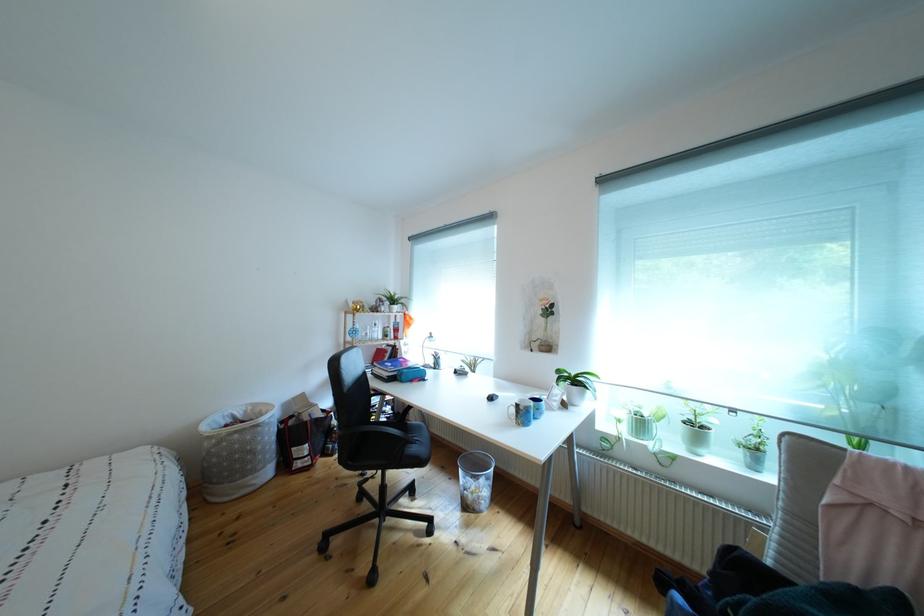
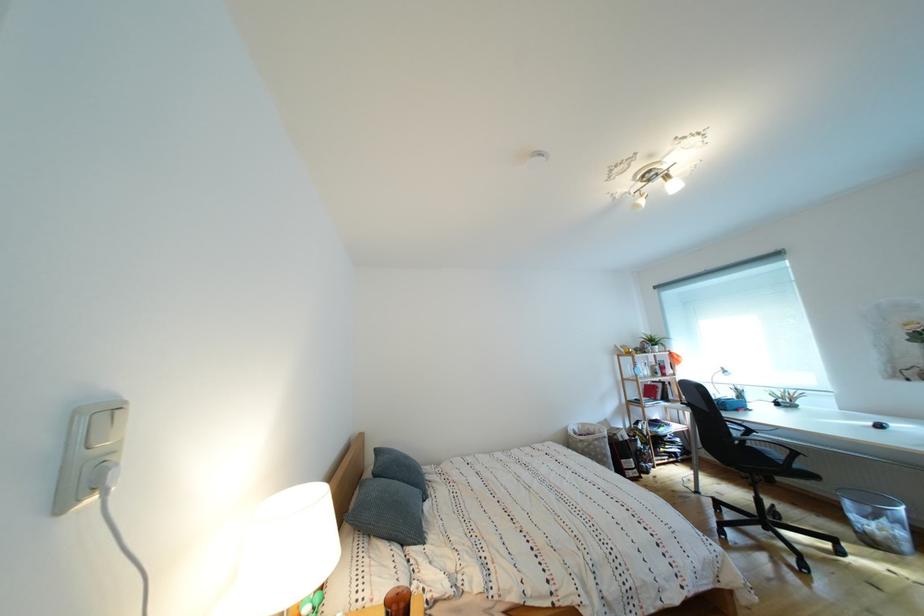
Locate, in the second image, the point that corresponds to point (493, 487) in the first image.

(896, 527)